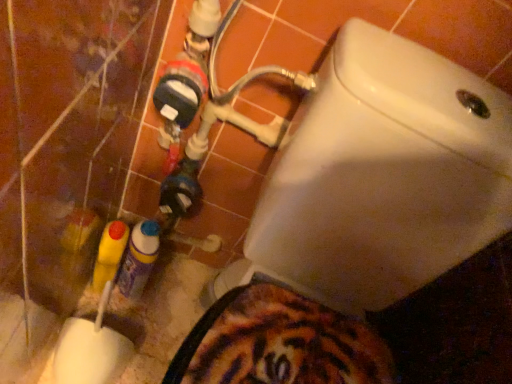
This screenshot has height=384, width=512. I want to click on translucent plastic spray can at lower left, the second bottle positioned from the left, so [138, 259].

Considering the relative positions of white glossy toilet at upper right and yellow plastic bottle at lower left, the second bottle when ordered from right to left, in the image provided, is white glossy toilet at upper right to the right of yellow plastic bottle at lower left, the second bottle when ordered from right to left, from the viewer's perspective?

Correct, you'll find white glossy toilet at upper right to the right of yellow plastic bottle at lower left, the second bottle when ordered from right to left.

From a real-world perspective, is white glossy toilet at upper right physically above yellow plastic bottle at lower left, the second bottle when ordered from right to left?

Yes, from a real-world perspective, white glossy toilet at upper right is over yellow plastic bottle at lower left, the second bottle when ordered from right to left

Is point (384, 287) positioned after point (97, 276)?

No, it is in front of (97, 276).

Who is taller, yellow plastic bottle at lower left, the 1th bottle in the left-to-right sequence, or translucent plastic spray can at lower left, the second bottle positioned from the left?

translucent plastic spray can at lower left, the second bottle positioned from the left, is taller.

Between yellow plastic bottle at lower left, the second bottle when ordered from right to left, and translucent plastic spray can at lower left, the second bottle positioned from the left, which one has larger width?

translucent plastic spray can at lower left, the second bottle positioned from the left.

In the image, is yellow plastic bottle at lower left, the second bottle when ordered from right to left, on the left side or the right side of translucent plastic spray can at lower left, acting as the 1th bottle starting from the right?

Based on their positions, yellow plastic bottle at lower left, the second bottle when ordered from right to left, is located to the left of translucent plastic spray can at lower left, acting as the 1th bottle starting from the right.

From a real-world perspective, which object rests below the other?

In real-world perspective, yellow plastic bottle at lower left, the 1th bottle in the left-to-right sequence, is lower.

Can you confirm if translucent plastic spray can at lower left, the second bottle positioned from the left, is smaller than white glossy toilet at upper right?

Yes.

From the image's perspective, which is above, translucent plastic spray can at lower left, the second bottle positioned from the left, or white glossy toilet at upper right?

translucent plastic spray can at lower left, the second bottle positioned from the left, from the image's perspective.

At what (x,y) coordinates should I click in order to perform the action: click on bottle that is the 1st object located above the white glossy toilet at upper right (from the image's perspective). Please return your answer as a coordinate pair (x, y). Looking at the image, I should click on (138, 259).

Considering the relative positions of translucent plastic spray can at lower left, the second bottle positioned from the left, and white glossy toilet at upper right in the image provided, is translucent plastic spray can at lower left, the second bottle positioned from the left, in front of white glossy toilet at upper right?

No, it is not.

Would you say white glossy toilet at upper right is a long distance from translucent plastic spray can at lower left, the second bottle positioned from the left?

Actually, white glossy toilet at upper right and translucent plastic spray can at lower left, the second bottle positioned from the left, are a little close together.

Would you say translucent plastic spray can at lower left, acting as the 1th bottle starting from the right, is part of white glossy toilet at upper right's contents?

That's incorrect, translucent plastic spray can at lower left, acting as the 1th bottle starting from the right, is not inside white glossy toilet at upper right.

Is point (237, 281) closer or farther from the camera than point (122, 291)?

Point (237, 281).

Between white glossy toilet at upper right and translucent plastic spray can at lower left, acting as the 1th bottle starting from the right, which one appears on the right side from the viewer's perspective?

Positioned to the right is white glossy toilet at upper right.

Find the location of `bottle that is behind the yellow plastic bottle at lower left, the second bottle when ordered from right to left`. bottle that is behind the yellow plastic bottle at lower left, the second bottle when ordered from right to left is located at coordinates (138, 259).

Based on the photo, which is farther from the camera, (140, 237) or (110, 274)?

Positioned behind is point (110, 274).

Does translucent plastic spray can at lower left, acting as the 1th bottle starting from the right, have a lesser width compared to yellow plastic bottle at lower left, the second bottle when ordered from right to left?

No.

Could you tell me if translucent plastic spray can at lower left, the second bottle positioned from the left, is facing yellow plastic bottle at lower left, the 1th bottle in the left-to-right sequence?

No, translucent plastic spray can at lower left, the second bottle positioned from the left, is not aimed at yellow plastic bottle at lower left, the 1th bottle in the left-to-right sequence.

Is yellow plastic bottle at lower left, the second bottle when ordered from right to left, positioned before white glossy toilet at upper right?

No, yellow plastic bottle at lower left, the second bottle when ordered from right to left, is further to the viewer.

From a real-world perspective, does yellow plastic bottle at lower left, the 1th bottle in the left-to-right sequence, stand above white glossy toilet at upper right?

No, from a real-world perspective, yellow plastic bottle at lower left, the 1th bottle in the left-to-right sequence, is not on top of white glossy toilet at upper right.

Does yellow plastic bottle at lower left, the 1th bottle in the left-to-right sequence, appear on the right side of white glossy toilet at upper right?

In fact, yellow plastic bottle at lower left, the 1th bottle in the left-to-right sequence, is to the left of white glossy toilet at upper right.

Between yellow plastic bottle at lower left, the 1th bottle in the left-to-right sequence, and white glossy toilet at upper right, which one has less height?

Standing shorter between the two is yellow plastic bottle at lower left, the 1th bottle in the left-to-right sequence.

There is a white glossy toilet at upper right. Identify the location of the 2nd bottle below it (from a real-world perspective). This screenshot has width=512, height=384. (109, 253).

Find the location of a particular element. bottle in front of the translucent plastic spray can at lower left, acting as the 1th bottle starting from the right is located at coordinates (109, 253).

Estimate the real-world distances between objects in this image. Which object is further from yellow plastic bottle at lower left, the second bottle when ordered from right to left, translucent plastic spray can at lower left, the second bottle positioned from the left, or white glossy toilet at upper right?

white glossy toilet at upper right.

From the image, which object appears to be farther from translucent plastic spray can at lower left, the second bottle positioned from the left, white glossy toilet at upper right or yellow plastic bottle at lower left, the 1th bottle in the left-to-right sequence?

white glossy toilet at upper right lies further to translucent plastic spray can at lower left, the second bottle positioned from the left, than the other object.

From the image, which object appears to be farther from yellow plastic bottle at lower left, the second bottle when ordered from right to left, white glossy toilet at upper right or translucent plastic spray can at lower left, acting as the 1th bottle starting from the right?

white glossy toilet at upper right is further to yellow plastic bottle at lower left, the second bottle when ordered from right to left.

Which object lies nearer to the anchor point translucent plastic spray can at lower left, the second bottle positioned from the left, yellow plastic bottle at lower left, the 1th bottle in the left-to-right sequence, or white glossy toilet at upper right?

yellow plastic bottle at lower left, the 1th bottle in the left-to-right sequence.

From the image, which object appears to be nearer to white glossy toilet at upper right, translucent plastic spray can at lower left, acting as the 1th bottle starting from the right, or yellow plastic bottle at lower left, the 1th bottle in the left-to-right sequence?

translucent plastic spray can at lower left, acting as the 1th bottle starting from the right, is positioned closer to the anchor white glossy toilet at upper right.

Looking at the image, which one is located closer to white glossy toilet at upper right, yellow plastic bottle at lower left, the second bottle when ordered from right to left, or translucent plastic spray can at lower left, acting as the 1th bottle starting from the right?

translucent plastic spray can at lower left, acting as the 1th bottle starting from the right, is closer to white glossy toilet at upper right.

Locate an element on the screen. bottle between white glossy toilet at upper right and translucent plastic spray can at lower left, the second bottle positioned from the left, along the z-axis is located at coordinates (109, 253).